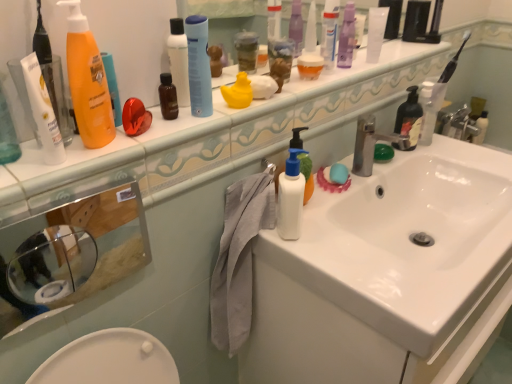
Question: Which direction should I rotate to look at blue matte spray can at upper center, which ranks as the second cleaning product in front-to-back order?

Choices:
 (A) left
 (B) right

Answer: (A)

Question: Should I look upward or downward to see white plastic toothbrush at upper right?

Choices:
 (A) up
 (B) down

Answer: (A)

Question: Would you say orange matte bottle at upper left, which ranks as the 1th cleaning product in front-to-back order, is part of transparent glass mirror at upper left's contents?

Choices:
 (A) yes
 (B) no

Answer: (B)

Question: Considering the relative positions of transparent glass mirror at upper left and orange matte bottle at upper left, the third cleaning product in the back-to-front sequence, in the image provided, is transparent glass mirror at upper left to the right of orange matte bottle at upper left, the third cleaning product in the back-to-front sequence, from the viewer's perspective?

Choices:
 (A) no
 (B) yes

Answer: (A)

Question: Is transparent glass mirror at upper left at the left side of orange matte bottle at upper left, the first cleaning product viewed from the left?

Choices:
 (A) yes
 (B) no

Answer: (A)

Question: Is transparent glass mirror at upper left facing towards orange matte bottle at upper left, the first cleaning product viewed from the left?

Choices:
 (A) yes
 (B) no

Answer: (B)

Question: Is transparent glass mirror at upper left thinner than orange matte bottle at upper left, marked as the third cleaning product in a right-to-left arrangement?

Choices:
 (A) yes
 (B) no

Answer: (B)

Question: Considering the relative sizes of transparent glass mirror at upper left and orange matte bottle at upper left, which ranks as the 1th cleaning product in front-to-back order, in the image provided, is transparent glass mirror at upper left shorter than orange matte bottle at upper left, which ranks as the 1th cleaning product in front-to-back order,?

Choices:
 (A) yes
 (B) no

Answer: (A)

Question: From the image's perspective, is blue matte soap at sink under white glossy sink at upper center?

Choices:
 (A) no
 (B) yes

Answer: (B)

Question: Is blue matte soap at sink directly adjacent to white glossy sink at upper center?

Choices:
 (A) no
 (B) yes

Answer: (A)

Question: Does blue matte soap at sink come in front of white glossy sink at upper center?

Choices:
 (A) no
 (B) yes

Answer: (A)

Question: From a real-world perspective, is blue matte soap at sink on top of white glossy sink at upper center?

Choices:
 (A) no
 (B) yes

Answer: (A)

Question: Is blue matte soap at sink wider than white glossy sink at upper center?

Choices:
 (A) no
 (B) yes

Answer: (A)

Question: Considering the relative positions of blue matte soap at sink and white glossy sink at upper center in the image provided, is blue matte soap at sink to the left of white glossy sink at upper center from the viewer's perspective?

Choices:
 (A) no
 (B) yes

Answer: (A)

Question: From the image's perspective, does black matte soap dispenser at right, which ranks as the 3th toiletry in back-to-front order, appear higher than white glossy sink at upper center?

Choices:
 (A) no
 (B) yes

Answer: (A)